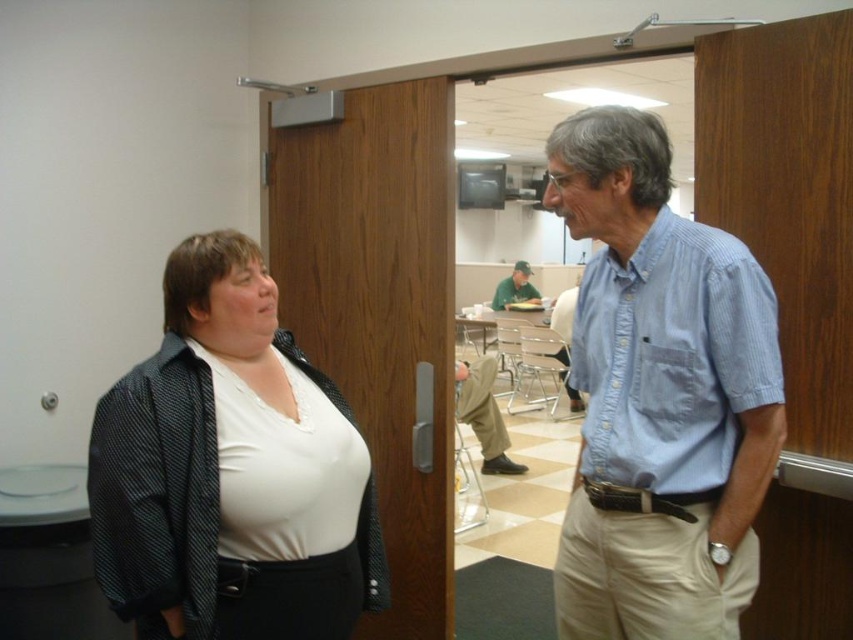
Question: Which object appears closest to the camera in this image?

Choices:
 (A) white matte shirt at center
 (B) blue striped shirt at center
 (C) khaki pants at center
 (D) white matte shirt at left

Answer: (A)

Question: Does blue striped shirt at center appear on the right side of green fabric cap at center?

Choices:
 (A) yes
 (B) no

Answer: (B)

Question: Does blue striped shirt at center appear over green fabric cap at center?

Choices:
 (A) yes
 (B) no

Answer: (B)

Question: Is blue striped shirt at center further to camera compared to white matte shirt at center?

Choices:
 (A) no
 (B) yes

Answer: (B)

Question: Which of the following is the farthest from the observer?

Choices:
 (A) (467, 387)
 (B) (170, 458)
 (C) (512, 292)
 (D) (613, 266)

Answer: (C)

Question: Which point is farther to the camera?

Choices:
 (A) (532, 284)
 (B) (636, 419)

Answer: (A)